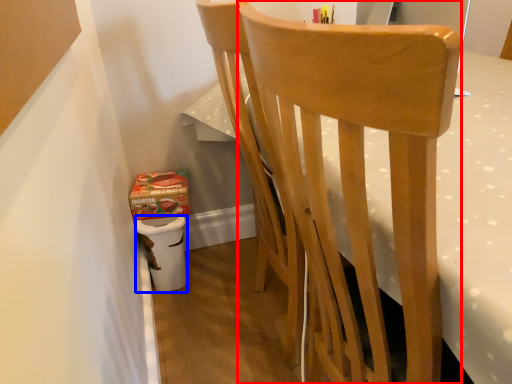
Question: Which object appears farthest to the camera in this image, chair (highlighted by a red box) or potty (highlighted by a blue box)?

Choices:
 (A) chair
 (B) potty

Answer: (B)